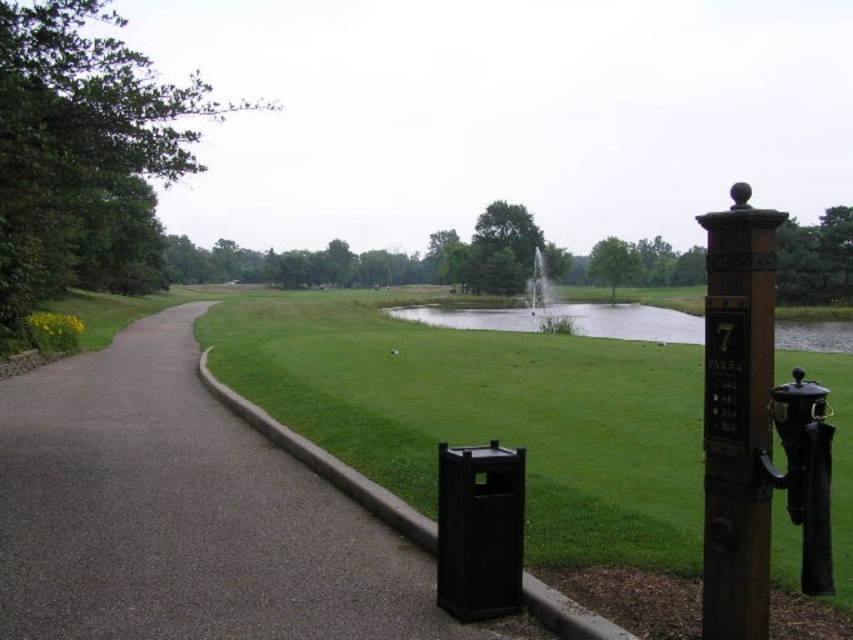
Question: Where is dark gray asphalt at left located in relation to green grass at center in the image?

Choices:
 (A) left
 (B) right

Answer: (A)

Question: Which point is closer to the camera?

Choices:
 (A) (635, 337)
 (B) (619, 557)
 (C) (305, 561)

Answer: (B)

Question: Which of the following is the closest to the observer?

Choices:
 (A) (637, 323)
 (B) (392, 483)

Answer: (B)

Question: Is green grass at center further to the viewer compared to green grassy lake at center?

Choices:
 (A) no
 (B) yes

Answer: (B)

Question: Is dark gray asphalt at left bigger than green grass at center?

Choices:
 (A) yes
 (B) no

Answer: (B)

Question: Which of these objects is positioned closest to the green grassy lake at center?

Choices:
 (A) dark gray asphalt at left
 (B) green grass at center

Answer: (B)